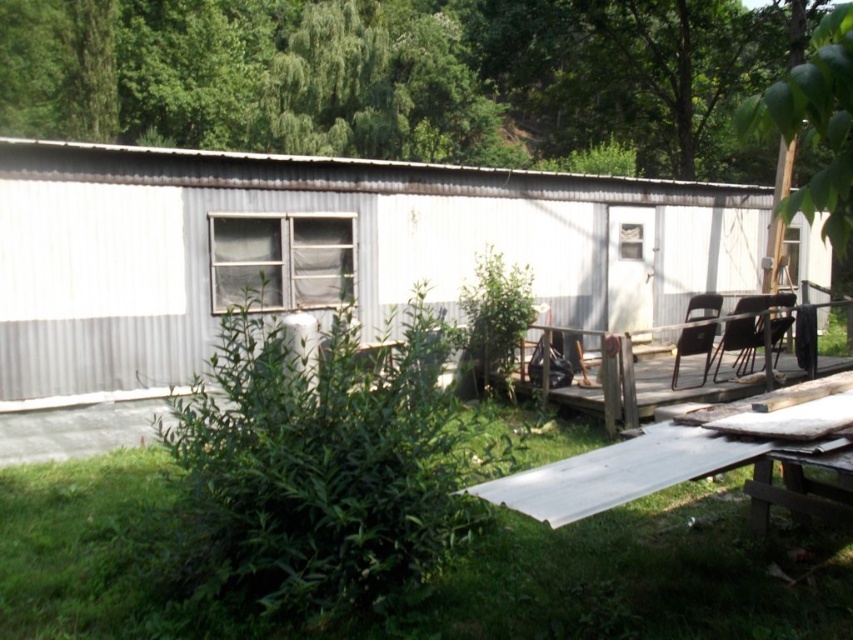
You are standing in front of the building and want to locate the green leafy tree at upper center. According to the coordinates provided, where would you look to find it?

The green leafy tree at upper center is located at the coordinates point (405,77).

You are standing in front of the corrugated metal building and looking towards the two green leafy trees. Which tree is closer to you, the green leafy tree at upper center or the green leafy tree at upper right?

The green leafy tree at upper center is closer to you because the green leafy tree at upper right is behind it.

You are standing at the origin point of the coordinate system. There is a white corrugated metal hut at center marked by point (x=318, y=252). Can you tell me the direction of the white corrugated metal hut from your current position?

The white corrugated metal hut at center is located at point (x=318, y=252), so it is directly in front of you at the center position.